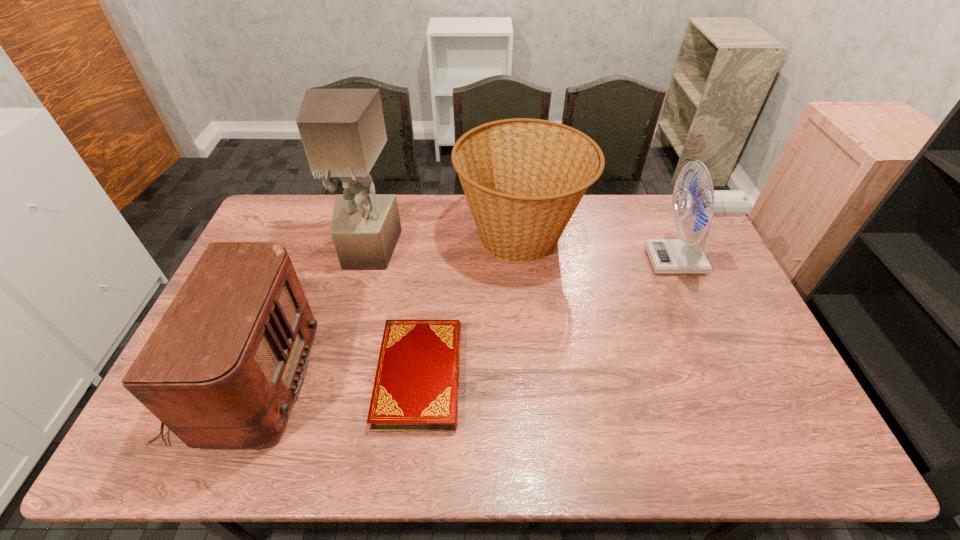
In the image, there is a desktop. Where is `free space at the near edge`? The width and height of the screenshot is (960, 540). free space at the near edge is located at coordinates (562, 429).

Find the location of a particular element. The height and width of the screenshot is (540, 960). vacant space at the right edge of the desktop is located at coordinates (756, 417).

This screenshot has height=540, width=960. In order to click on vacant area between the basket and the tallest object in this screenshot , I will do `click(444, 243)`.

Identify the location of vacant point located between the tallest object and the basket. (444, 243).

Locate an element on the screen. vacant space in between the shortest object and the rightmost object is located at coordinates (550, 318).

This screenshot has width=960, height=540. In order to click on vacant space that's between the hardback book and the radio receiver in this screenshot , I will do [x=333, y=377].

Locate an element on the screen. The width and height of the screenshot is (960, 540). empty location between the radio receiver and the rightmost object is located at coordinates (464, 320).

In order to click on free space between the sculpture and the basket in this screenshot , I will do `click(444, 243)`.

You are a GUI agent. You are given a task and a screenshot of the screen. Output one action in this format:
    pyautogui.click(x=<x>, y=<y>)
    Task: Click on the object that stands as the fourth closest to the radio receiver
    The height and width of the screenshot is (540, 960).
    Given the screenshot: What is the action you would take?
    pyautogui.click(x=668, y=256)

The height and width of the screenshot is (540, 960). In order to click on object that ranks as the closest to the hardback book in this screenshot , I will do `click(222, 369)`.